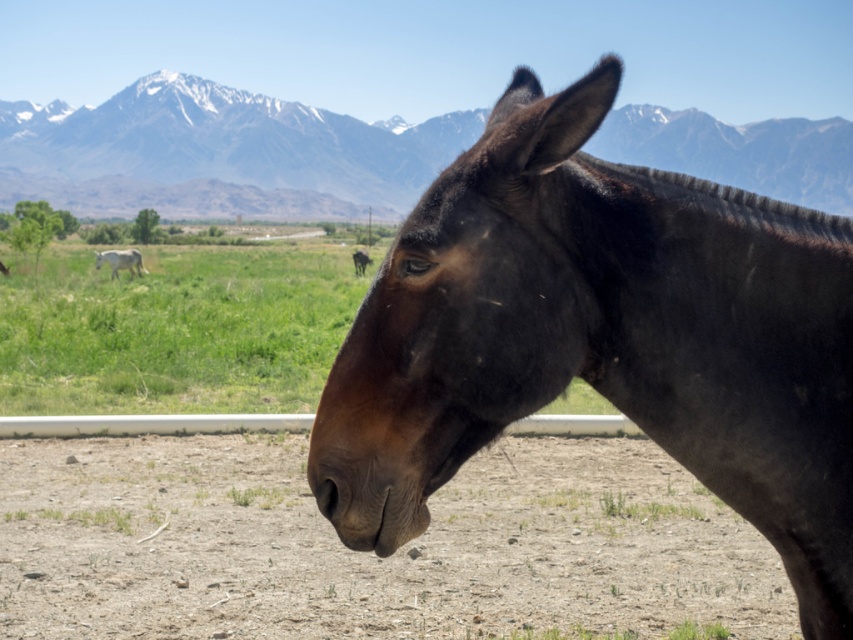
Is brown glossy horse at center positioned at the back of green grass at center?

No, brown glossy horse at center is in front of green grass at center.

Does brown glossy horse at center have a greater width compared to green grass at center?

In fact, brown glossy horse at center might be narrower than green grass at center.

Is point (534, 269) in front of point (38, 403)?

Yes.

Where is `brown glossy horse at center`? This screenshot has height=640, width=853. brown glossy horse at center is located at coordinates [x=602, y=337].

Does snowy rock mountain at upper center appear over white glossy horse at left?

Indeed, snowy rock mountain at upper center is positioned over white glossy horse at left.

The image size is (853, 640). What do you see at coordinates (230, 141) in the screenshot?
I see `snowy rock mountain at upper center` at bounding box center [230, 141].

Where is `snowy rock mountain at upper center`? snowy rock mountain at upper center is located at coordinates (230, 141).

You are a GUI agent. You are given a task and a screenshot of the screen. Output one action in this format:
    pyautogui.click(x=<x>, y=<y>)
    Task: Click on the snowy rock mountain at upper center
    This screenshot has height=640, width=853.
    Given the screenshot: What is the action you would take?
    pyautogui.click(x=230, y=141)

Is snowy rock mountain at upper center positioned in front of brown matte donkey at center?

That is True.

Is point (270, 131) positioned in front of point (368, 257)?

No.

The image size is (853, 640). What are the coordinates of `snowy rock mountain at upper center` in the screenshot? It's located at (230, 141).